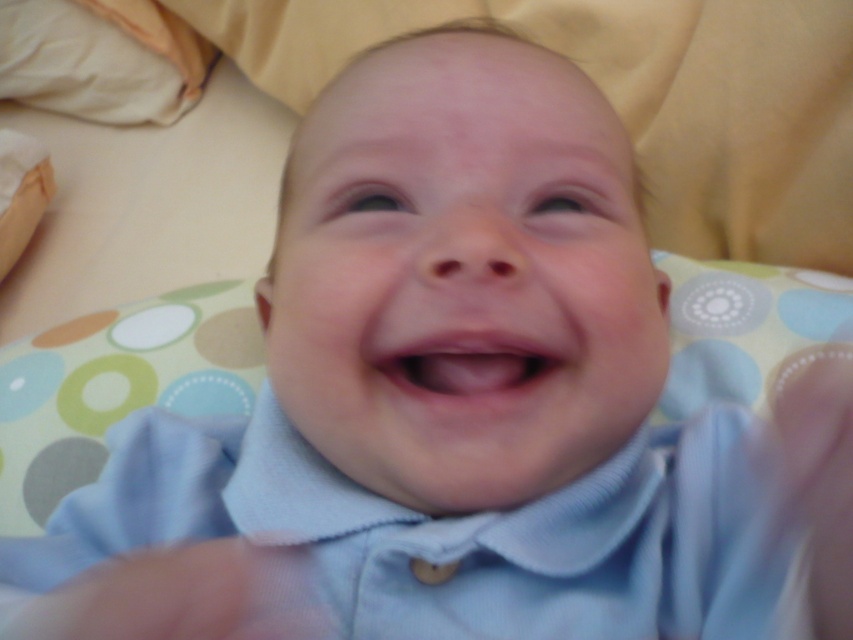
Does light blue cotton shirt at center lie in front of pink smooth flesh at center?

Yes, light blue cotton shirt at center is closer to the viewer.

Between light blue cotton shirt at center and pink smooth flesh at center, which one has more height?

light blue cotton shirt at center is taller.

Does point (675, 541) come behind point (450, 401)?

That is True.

You are a GUI agent. You are given a task and a screenshot of the screen. Output one action in this format:
    pyautogui.click(x=<x>, y=<y>)
    Task: Click on the light blue cotton shirt at center
    The image size is (853, 640).
    Given the screenshot: What is the action you would take?
    (456, 534)

From the picture: Does white soft pillow at upper left have a greater height compared to pink smooth flesh at center?

Yes.

In the scene shown: Which is more to the right, white soft pillow at upper left or pink smooth flesh at center?

pink smooth flesh at center is more to the right.

Who is more forward, (154, 4) or (509, 381)?

Point (509, 381)

Find the location of a particular element. The height and width of the screenshot is (640, 853). white soft pillow at upper left is located at coordinates (102, 58).

Can you confirm if light blue cotton shirt at center is positioned to the left of white soft pillow at upper left?

In fact, light blue cotton shirt at center is to the right of white soft pillow at upper left.

Does light blue cotton shirt at center have a lesser height compared to white soft pillow at upper left?

Correct, light blue cotton shirt at center is not as tall as white soft pillow at upper left.

Is point (695, 428) farther from viewer compared to point (161, 54)?

No, (695, 428) is in front of (161, 54).

Find the location of a particular element. This screenshot has width=853, height=640. light blue cotton shirt at center is located at coordinates (456, 534).